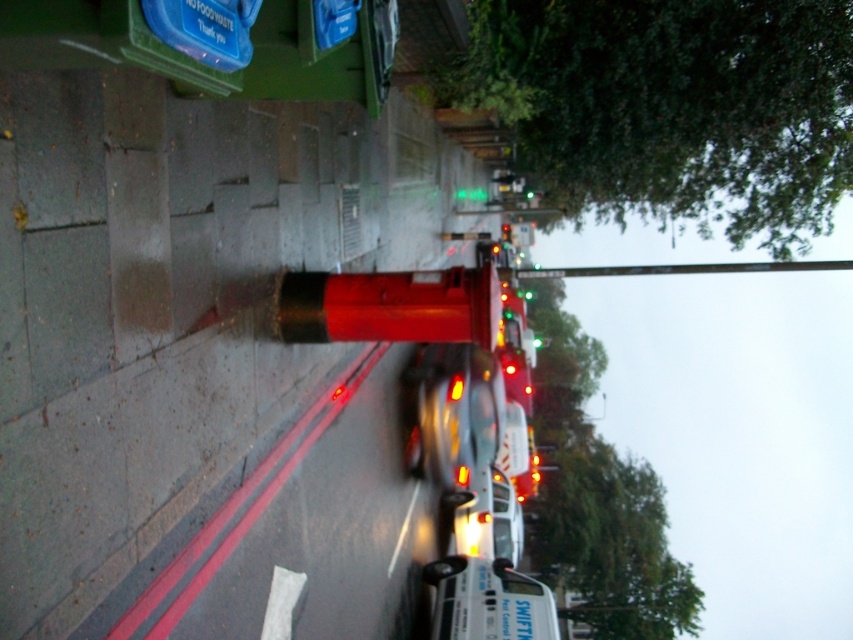
In the scene shown: You are a pedestrian standing on the sidewalk near the red cylindrical bollard. You want to cross the street to reach a store on the opposite side. The green glass traffic light at center is currently red. Can you safely cross the street while avoiding the white glossy van at center?

The white glossy van at center is to the left of the green glass traffic light at center. Since the traffic light is red, vehicles should be stopped, but the van might still be in your path. Wait until the light turns green and the van has passed before crossing.

You are driving a car that is 4.5 meters long. You want to park your car between the white glossy van at center and the green glass traffic light at center. Is there enough space between them to park your car?

The distance between the white glossy van at center and the green glass traffic light at center is 27.92 meters. Since your car is only 4.5 meters long, there is more than enough space to park between them.